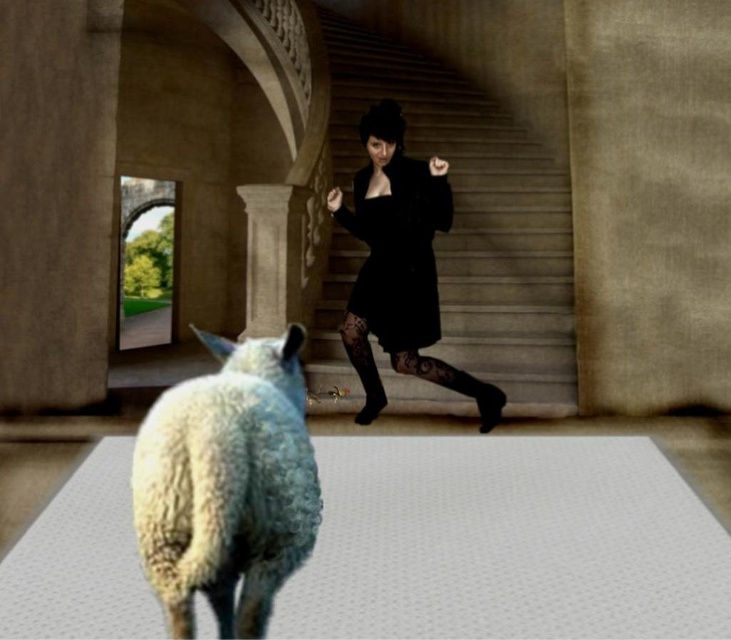
Does black textured dress at center have a lesser height compared to black matte dress at center?

Incorrect, black textured dress at center's height does not fall short of black matte dress at center's.

Between black textured dress at center and black matte dress at center, which one is positioned higher?

black matte dress at center is above.

Describe the element at coordinates (398, 266) in the screenshot. I see `black textured dress at center` at that location.

Where is `black textured dress at center`? black textured dress at center is located at coordinates (398, 266).

Is smooth stone stairs at center below white woolen sheep at lower left?

Actually, smooth stone stairs at center is above white woolen sheep at lower left.

Describe the element at coordinates (473, 212) in the screenshot. The height and width of the screenshot is (640, 731). I see `smooth stone stairs at center` at that location.

Identify the location of smooth stone stairs at center. (473, 212).

Between point (446, 140) and point (363, 337), which one is positioned behind?

The point (446, 140) is more distant.

Between smooth stone stairs at center and black lace boot at center, which one is positioned higher?

Positioned higher is smooth stone stairs at center.

Find the location of a particular element. This screenshot has width=731, height=640. smooth stone stairs at center is located at coordinates (473, 212).

Find the location of a particular element. This screenshot has width=731, height=640. smooth stone stairs at center is located at coordinates (473, 212).